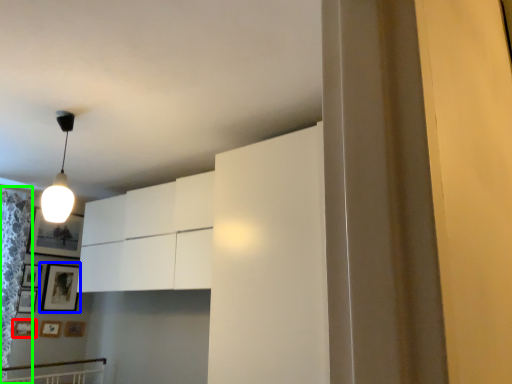
Question: Considering the real-world distances, which object is closest to picture frame (highlighted by a red box)? picture frame (highlighted by a blue box) or curtain (highlighted by a green box).

Choices:
 (A) picture frame
 (B) curtain

Answer: (A)